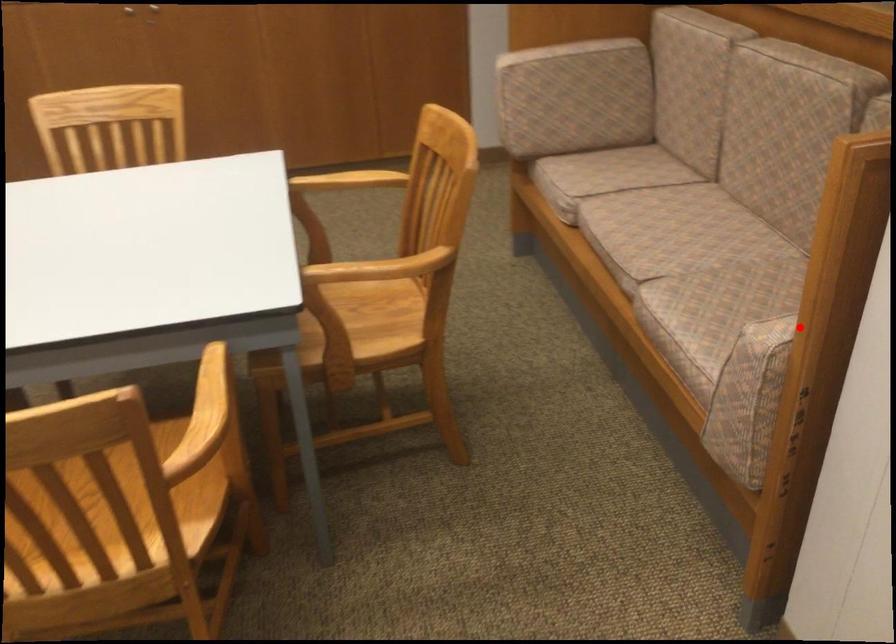
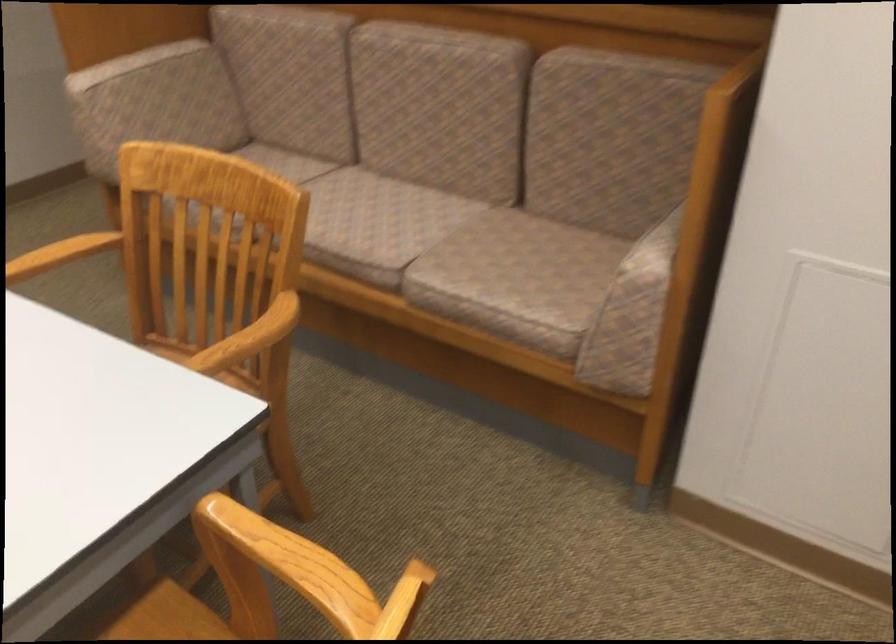
Where in the second image is the point corresponding to the highlighted location from the first image?

(655, 248)